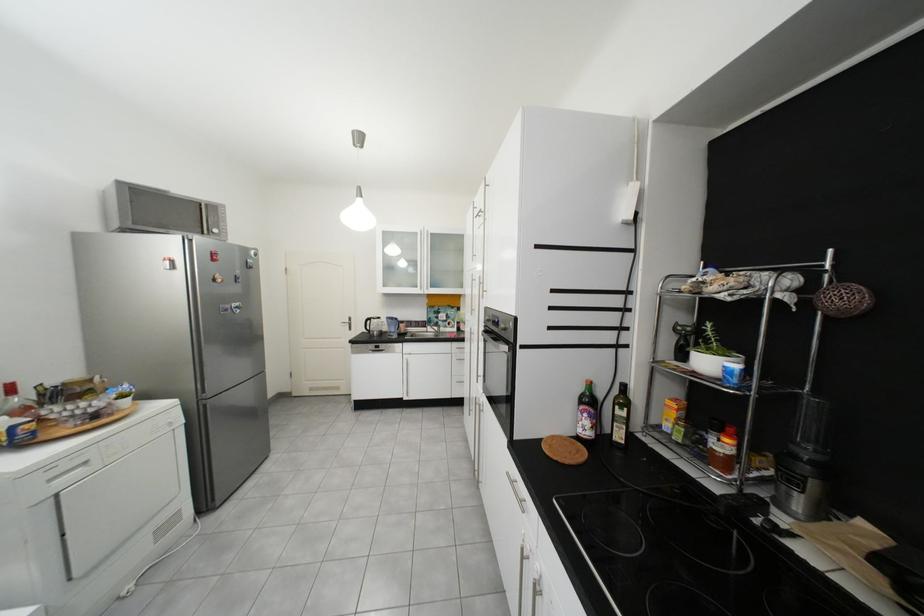
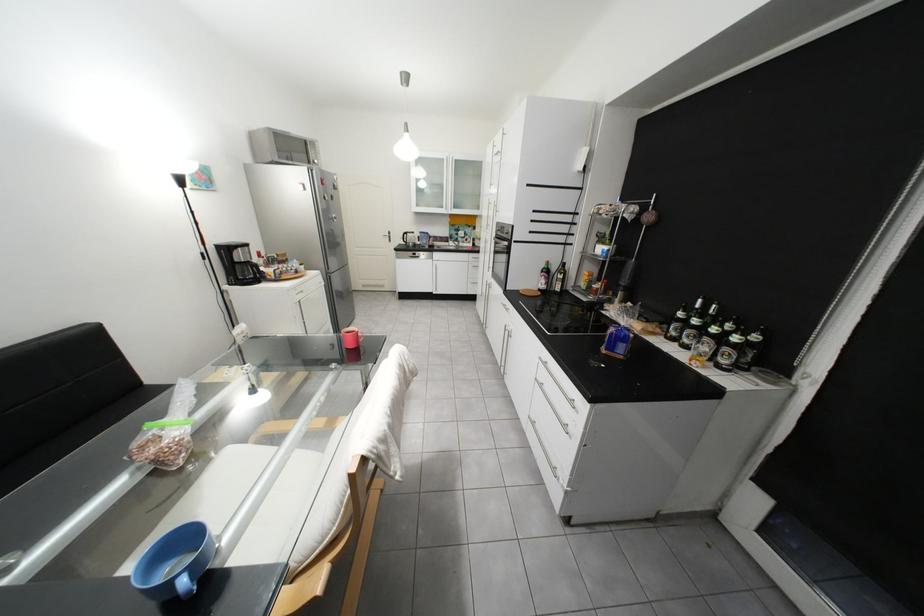
Locate, in the second image, the point that corresponds to point 361,320 in the first image.

(402, 233)